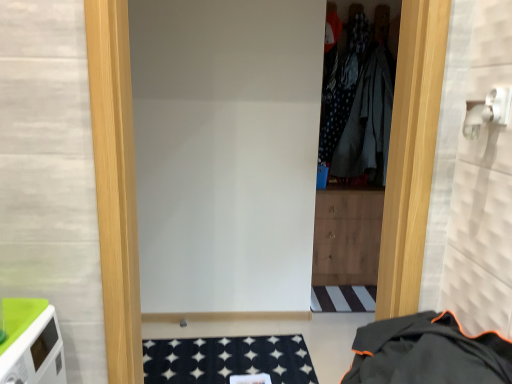
Question: From the image's perspective, is black fabric jacket at lower right, the 1th clothing in the bottom-to-top sequence, over dark grey fabric at center, the 1th clothing in the top-to-bottom sequence?

Choices:
 (A) no
 (B) yes

Answer: (A)

Question: Is black fabric jacket at lower right, the 1th clothing viewed from the front, positioned with its back to dark grey fabric at center, the 1th clothing in the top-to-bottom sequence?

Choices:
 (A) no
 (B) yes

Answer: (A)

Question: Is black fabric jacket at lower right, the second clothing when ordered from back to front, placed right next to dark grey fabric at center, the 1th clothing in the top-to-bottom sequence?

Choices:
 (A) no
 (B) yes

Answer: (A)

Question: Does black fabric jacket at lower right, the 1th clothing in the bottom-to-top sequence, have a greater height compared to dark grey fabric at center, the 2th clothing from the front?

Choices:
 (A) no
 (B) yes

Answer: (A)

Question: Does black fabric jacket at lower right, the 1th clothing viewed from the front, have a smaller size compared to dark grey fabric at center, the 2th clothing from the front?

Choices:
 (A) no
 (B) yes

Answer: (A)

Question: Considering the positions of white matte door at center and black fabric jacket at lower right, the 1th clothing viewed from the front, in the image, is white matte door at center wider or thinner than black fabric jacket at lower right, the 1th clothing viewed from the front,?

Choices:
 (A) thin
 (B) wide

Answer: (A)

Question: Considering the positions of white matte door at center and black fabric jacket at lower right, the 1th clothing in the bottom-to-top sequence, in the image, is white matte door at center taller or shorter than black fabric jacket at lower right, the 1th clothing in the bottom-to-top sequence,?

Choices:
 (A) tall
 (B) short

Answer: (A)

Question: Considering the positions of point (133, 279) and point (424, 317), is point (133, 279) closer or farther from the camera than point (424, 317)?

Choices:
 (A) farther
 (B) closer

Answer: (A)

Question: In the image, is white matte door at center positioned in front of or behind black fabric jacket at lower right, the 1th clothing in the bottom-to-top sequence?

Choices:
 (A) front
 (B) behind

Answer: (B)

Question: Is point (402, 332) positioned closer to the camera than point (132, 205)?

Choices:
 (A) farther
 (B) closer

Answer: (B)

Question: From a real-world perspective, is black fabric jacket at lower right, the 1th clothing viewed from the front, positioned above or below white matte door at center?

Choices:
 (A) above
 (B) below

Answer: (B)

Question: Considering the positions of black fabric jacket at lower right, the 1th clothing in the bottom-to-top sequence, and white matte door at center in the image, is black fabric jacket at lower right, the 1th clothing in the bottom-to-top sequence, taller or shorter than white matte door at center?

Choices:
 (A) short
 (B) tall

Answer: (A)

Question: In the image, is black fabric jacket at lower right, the 1th clothing viewed from the front, positioned in front of or behind white matte door at center?

Choices:
 (A) front
 (B) behind

Answer: (A)

Question: Is black fabric jacket at lower right, the second clothing when ordered from back to front, situated inside dark grey fabric at center, the first clothing positioned from the back, or outside?

Choices:
 (A) outside
 (B) inside

Answer: (A)

Question: In the image, is black fabric jacket at lower right, the 1th clothing viewed from the front, positioned in front of or behind dark grey fabric at center, acting as the second clothing starting from the bottom?

Choices:
 (A) front
 (B) behind

Answer: (A)